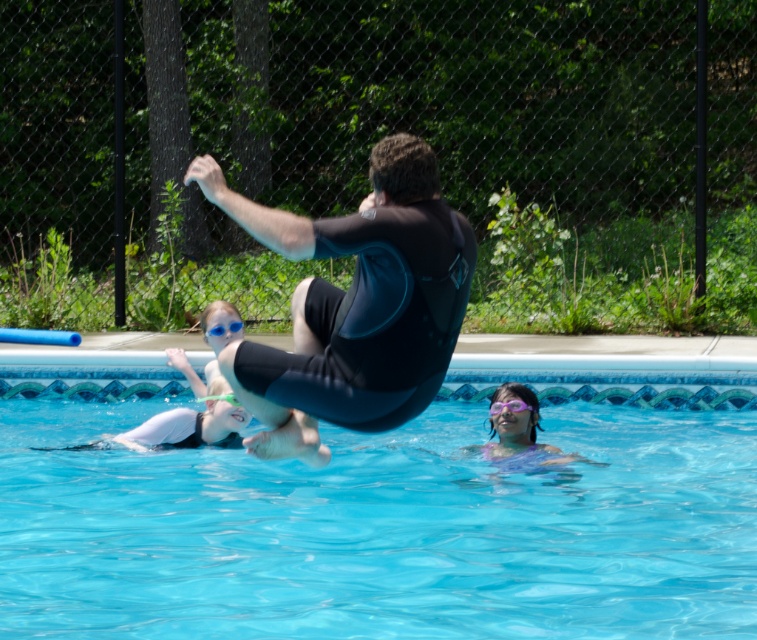
Question: Which of the following is the farthest from the observer?

Choices:
 (A) black matte wetsuit at center
 (B) purple matte goggles at lower center
 (C) blue plastic goggles at center
 (D) transparent blue water at center

Answer: (C)

Question: Does blue plastic goggles at center appear on the left side of purple matte goggles at lower center?

Choices:
 (A) no
 (B) yes

Answer: (B)

Question: Which point appears closest to the camera in this image?

Choices:
 (A) pyautogui.click(x=215, y=333)
 (B) pyautogui.click(x=606, y=620)
 (C) pyautogui.click(x=318, y=384)

Answer: (B)

Question: Which point appears farthest from the camera in this image?

Choices:
 (A) (213, 332)
 (B) (89, 508)

Answer: (A)

Question: Does blue plastic goggles at center appear on the right side of purple matte goggles at lower center?

Choices:
 (A) yes
 (B) no

Answer: (B)

Question: Does black matte wetsuit at center have a lesser width compared to blue plastic goggles at center?

Choices:
 (A) no
 (B) yes

Answer: (A)